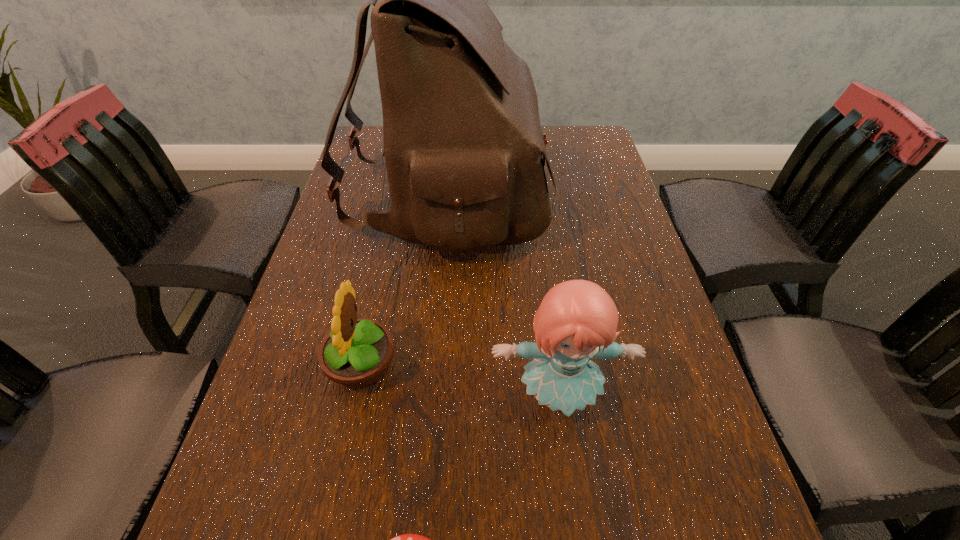
Where is `object that stands as the second closest to the satchel`? Image resolution: width=960 pixels, height=540 pixels. object that stands as the second closest to the satchel is located at coordinates (577, 320).

Select which object is the second closest to the farthest object. Please provide its 2D coordinates. Your answer should be formatted as a tuple, i.e. [(x, y)], where the tuple contains the x and y coordinates of a point satisfying the conditions above.

[(577, 320)]